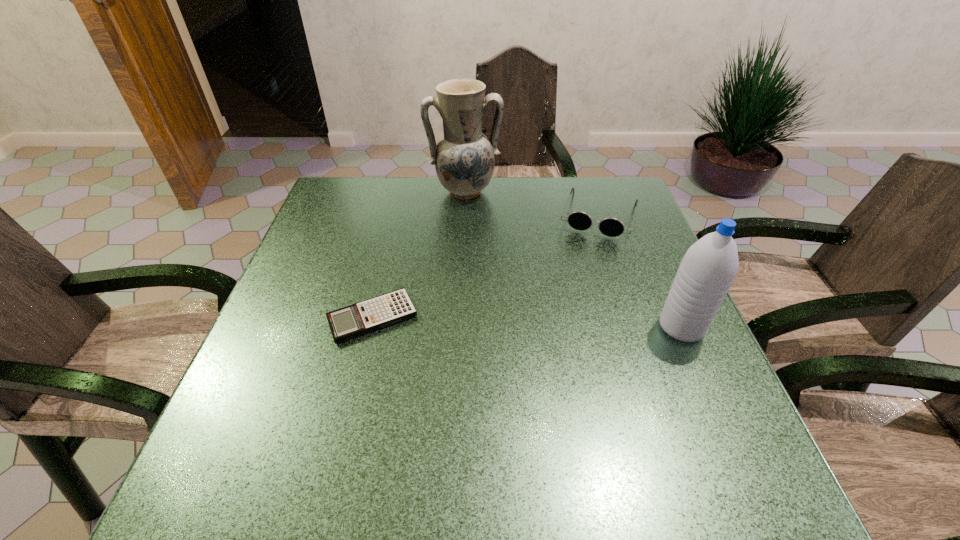
The height and width of the screenshot is (540, 960). Identify the location of free space on the desktop that is between the shortest object and the third shortest object and is positioned on either side of the pottery. (496, 321).

Locate an element on the screen. The width and height of the screenshot is (960, 540). free spot on the desktop that is between the shortest object and the second tallest object and is positioned on the front-facing side of the sunglasses is located at coordinates (567, 323).